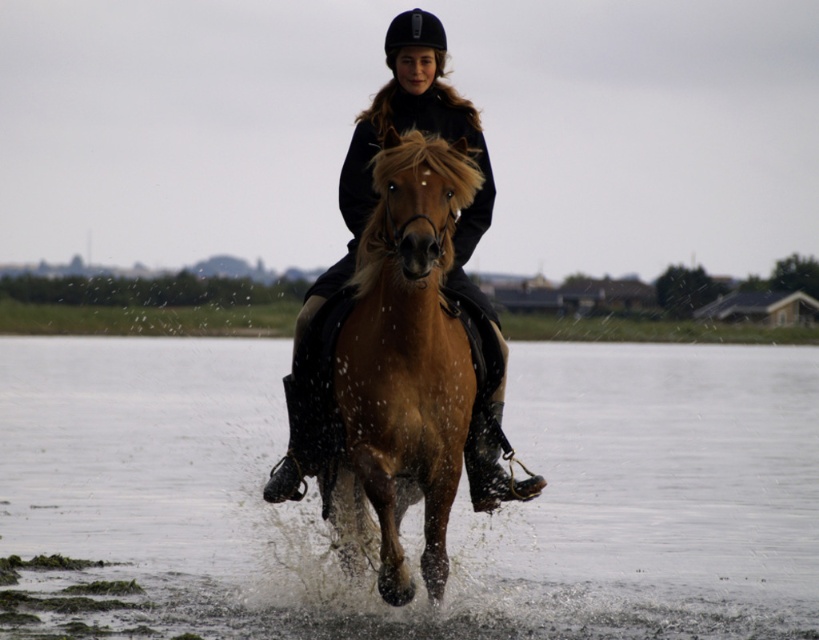
You are a photographer trying to capture the rider and horse in the scene. You notice two specific points in the image at coordinates point (440, 465) and point (469, 435). If you want to focus on the point that is nearer to your camera, which coordinate should you choose?

Point (440, 465) is closer to the camera than point (469, 435), so you should choose point (440, 465) to focus on the nearer point.

You are a photographer positioned at the edge of the water. You want to capture a photo of the brown glossy horse at center without the clear water at lower center appearing in the foreground. Is this possible based on their positions?

The clear water at lower center is further to the viewer than the brown glossy horse at center, so adjusting the camera angle to focus on the horse while avoiding the water in the foreground is not possible since the water is closer to the photographer.

You are a photographer trying to capture the horse and rider in the image. To ensure the reflection of the horse in the clear water at lower center is visible, where should you position yourself relative to the point at coordinates point (419, 502)?

To capture the reflection of the horse in the clear water at lower center, you should position yourself directly above or very close to the point at coordinates point (419, 502) because reflections are best viewed from the same angle as the light source, typically requiring a low camera angle near the water surface.